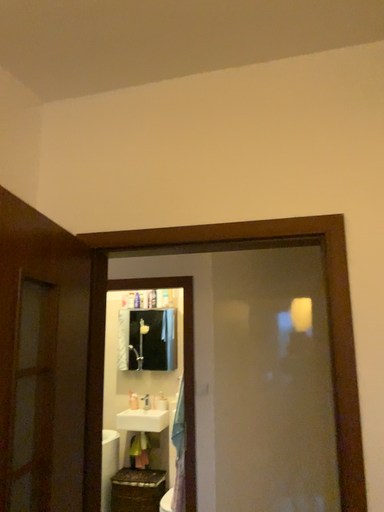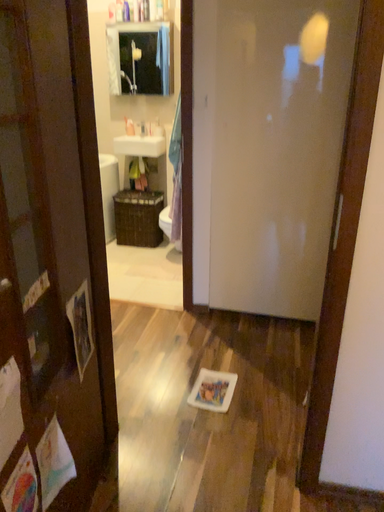
Question: How did the camera likely rotate when shooting the video?

Choices:
 (A) rotated downward
 (B) rotated upward

Answer: (A)